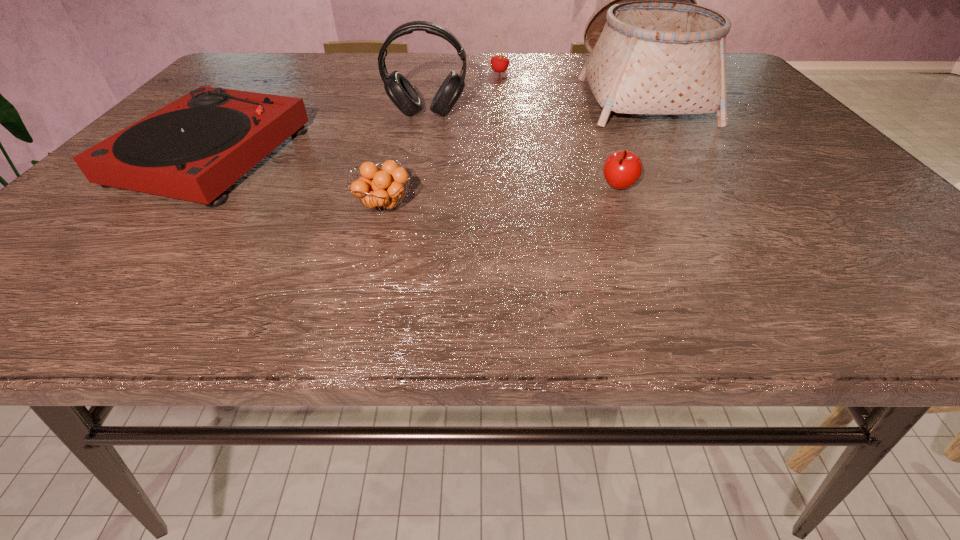
What are the coordinates of `basket` in the screenshot? It's located at (653, 50).

This screenshot has width=960, height=540. Identify the location of headset. (401, 92).

Identify the location of the left cherry. This screenshot has height=540, width=960. point(499,63).

Locate an element on the screen. The height and width of the screenshot is (540, 960). the farther cherry is located at coordinates (499, 63).

Where is `record player`? record player is located at coordinates (195, 148).

Locate an element on the screen. The height and width of the screenshot is (540, 960). the right cherry is located at coordinates (622, 169).

Identify the location of orange fruit. (380, 189).

Locate an element on the screen. Image resolution: width=960 pixels, height=540 pixels. free space located 0.220m with the lid open on the basket is located at coordinates (498, 92).

This screenshot has height=540, width=960. What are the coordinates of `vacant position located 0.400m with the lid open on the basket` in the screenshot? It's located at (429, 92).

At what (x,y) coordinates should I click in order to perform the action: click on vacant space located 0.100m with the lid open on the basket. Please return your answer as a coordinate pair (x, y). Image resolution: width=960 pixels, height=540 pixels. Looking at the image, I should click on (543, 92).